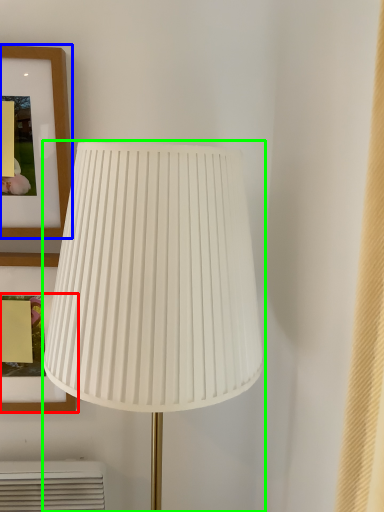
Question: Which is nearer to the picture frame (highlighted by a red box)? picture frame (highlighted by a blue box) or lamp (highlighted by a green box).

Choices:
 (A) picture frame
 (B) lamp

Answer: (B)